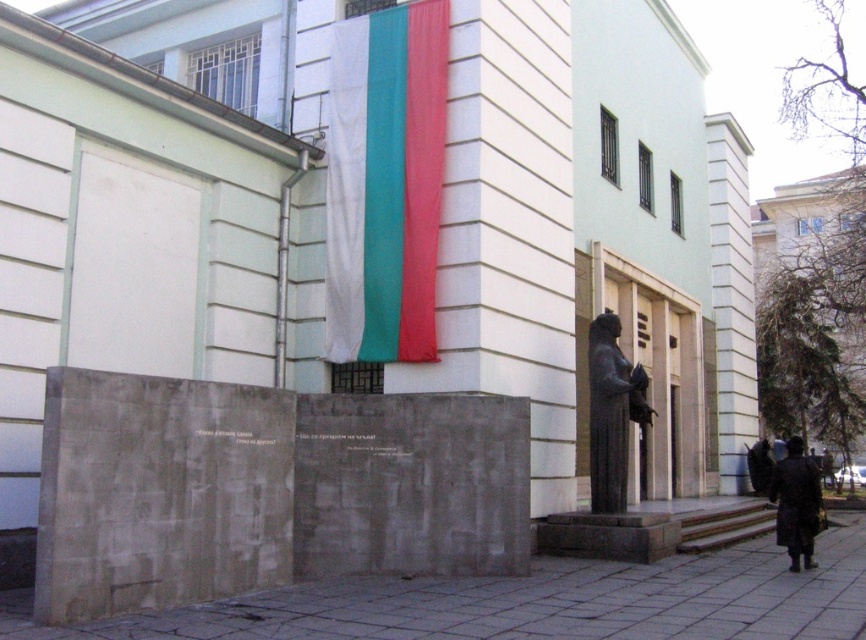
You are standing in front of the building and want to determine the relative positions of two points marked in the scene. Which point, point 1 at coordinates (595, 600) or point 2 at coordinates (799, 483), is closer to you?

Point 1 at coordinates (595, 600) is closer to the viewer than point 2 at coordinates (799, 483).

You are standing at the entrance of the building and want to walk to the gray concrete pavement at lower center. What are the coordinates of the point you need to aim for?

The coordinates of the gray concrete pavement at lower center are at point (531, 602).

You are a tourist standing in front of the building and want to take a photo of the dark brown leather coat at lower right. To ensure the black polished statue at right is also in the frame, should you move to your left or right?

You should move to your right to include both the black polished statue at right and the dark brown leather coat at lower right in the frame since the statue is to the left of the coat.